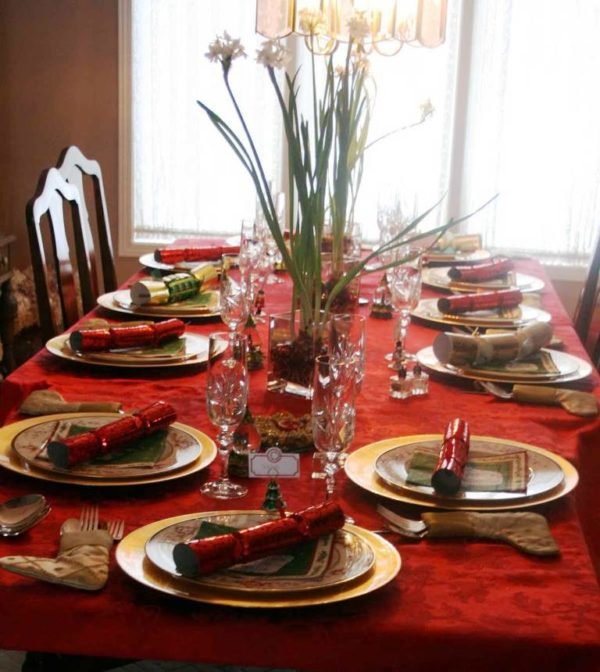
Locate an element on the screen. napkin is located at coordinates (141, 451), (155, 349), (196, 300), (282, 560), (497, 474), (533, 363), (496, 314), (492, 281).